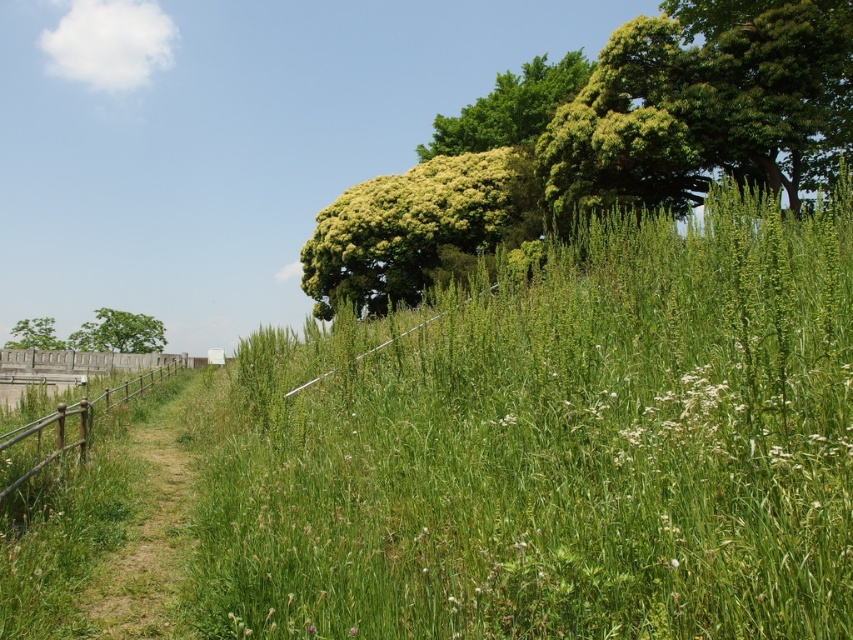
You are standing at the center of the path in the image. Looking towards the upper right corner, can you see a green leafy tree at point (x=601, y=144)? Please describe its position relative to the wooden fence on the left side of the image.

The green leafy tree at upper right is located at point (x=601, y=144), which is in the upper right corner of the image. The wooden fence on the left side is positioned to the left and lower relative to the tree.

You are standing at the center of the path in the image and want to walk towards the green leafy tree at upper right. Which direction should you head?

The green leafy tree at upper right is located at point (601, 144), so you should head towards the upper right direction to reach it.